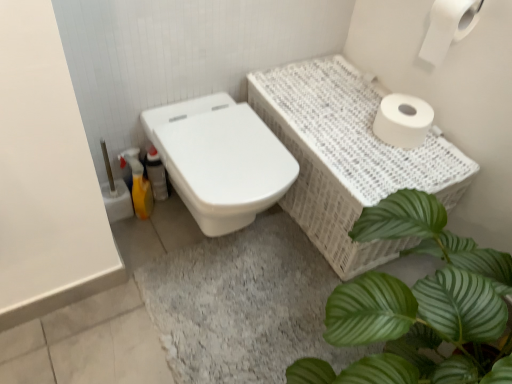
Locate an element on the screen. free space to the left of white matte toilet paper at upper right, the second toilet paper from the top is located at coordinates (347, 124).